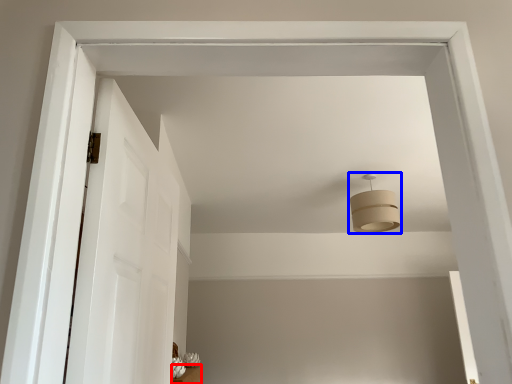
Question: Which point is closer to the camera, furniture (highlighted by a red box) or fixture (highlighted by a blue box)?

Choices:
 (A) furniture
 (B) fixture

Answer: (A)